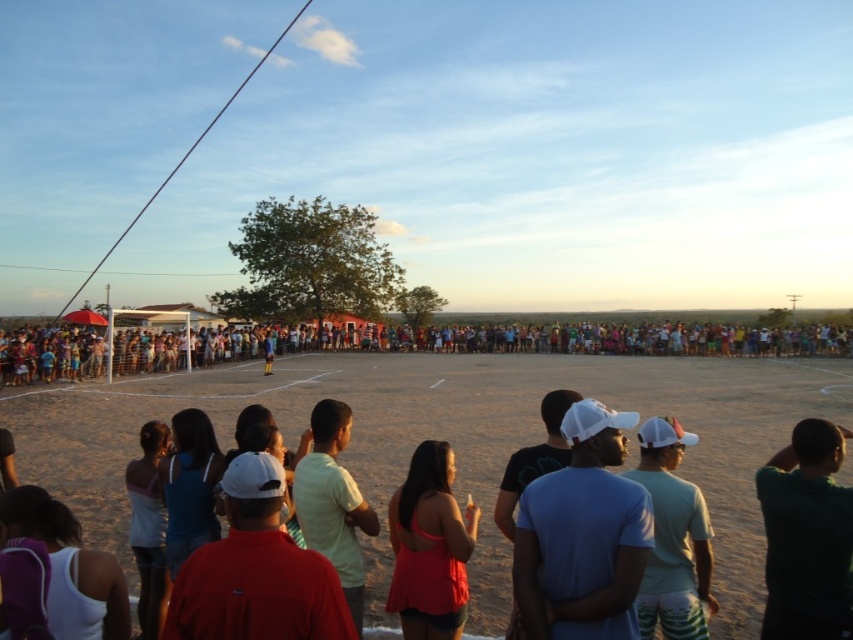
Question: Considering the real-world distances, which object is closest to the brown dirt field at center?

Choices:
 (A) white cap at center
 (B) white matte cap at center
 (C) matte pink tank top at center

Answer: (B)

Question: Can you confirm if brown dirt field at center is positioned below multicolored casual clothing at center?

Choices:
 (A) no
 (B) yes

Answer: (B)

Question: Considering the relative positions of white matte cap at center and dark green t-shirt at lower right in the image provided, where is white matte cap at center located with respect to dark green t-shirt at lower right?

Choices:
 (A) above
 (B) below

Answer: (A)

Question: Estimate the real-world distances between objects in this image. Which object is closer to the brown dirt field at center?

Choices:
 (A) light yellow t-shirt at center
 (B) red cotton shirt at center
 (C) white matte cap at center

Answer: (B)

Question: From the image, what is the correct spatial relationship of dark green t-shirt at lower right in relation to light yellow t-shirt at center?

Choices:
 (A) above
 (B) below

Answer: (A)

Question: Which of the following is the farthest from the observer?

Choices:
 (A) red cotton shirt at center
 (B) multicolored casual clothing at center
 (C) brown dirt field at center

Answer: (B)